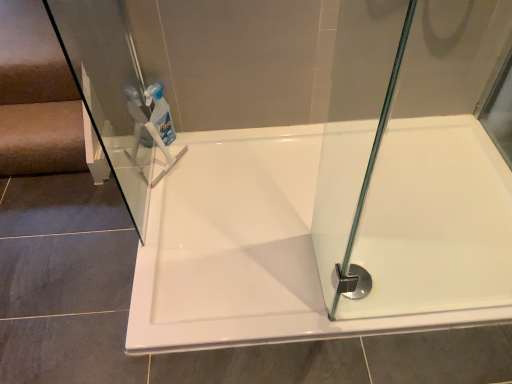
This screenshot has height=384, width=512. Find the location of `white glossy bathtub at center`. white glossy bathtub at center is located at coordinates (247, 251).

I want to click on transparent plastic bottle at upper center, so click(160, 113).

Locate an element on the screen. The height and width of the screenshot is (384, 512). white glossy bathtub at center is located at coordinates (247, 251).

Which point is more distant from viewer, (362, 287) or (173, 133)?

The point (173, 133) is farther.

Identify the location of cleaning product above the polished chrome shower at bottom right (from a real-world perspective). (160, 113).

What's the angular difference between polished chrome shower at bottom right and transparent plastic bottle at upper center's facing directions?

The facing directions of polished chrome shower at bottom right and transparent plastic bottle at upper center are 45.5 degrees apart.

In the image, is polished chrome shower at bottom right positioned in front of or behind white glossy bathtub at center?

Visually, polished chrome shower at bottom right is located behind white glossy bathtub at center.

Is point (367, 271) positioned before point (230, 279)?

No, it is not.

Is polished chrome shower at bottom right at the left side of white glossy bathtub at center?

Correct, you'll find polished chrome shower at bottom right to the left of white glossy bathtub at center.

In the scene shown: Is polished chrome shower at bottom right not close to white glossy bathtub at center?

A: No, there isn't a large distance between polished chrome shower at bottom right and white glossy bathtub at center.

Measure the distance between white glossy bathtub at center and polished chrome shower at bottom right.

They are 42.04 centimeters apart.

Can you tell me how much white glossy bathtub at center and polished chrome shower at bottom right differ in facing direction?

The facing directions of white glossy bathtub at center and polished chrome shower at bottom right are 1.78 degrees apart.

Is white glossy bathtub at center facing towards polished chrome shower at bottom right?

Yes.

Is white glossy bathtub at center not within polished chrome shower at bottom right?

white glossy bathtub at center is positioned outside polished chrome shower at bottom right.

From the image's perspective, between white glossy bathtub at center and transparent plastic bottle at upper center, which one is located above?

transparent plastic bottle at upper center appears higher in the image.

Does white glossy bathtub at center have a lesser width compared to transparent plastic bottle at upper center?

No, white glossy bathtub at center is not thinner than transparent plastic bottle at upper center.

How many degrees apart are the facing directions of white glossy bathtub at center and transparent plastic bottle at upper center?

They differ by 47.2 degrees in their facing directions.

Which object is further away from the camera taking this photo, white glossy bathtub at center or transparent plastic bottle at upper center?

transparent plastic bottle at upper center.

Considering the positions of objects transparent plastic bottle at upper center and polished chrome shower at bottom right in the image provided, who is more to the left, transparent plastic bottle at upper center or polished chrome shower at bottom right?

Positioned to the left is transparent plastic bottle at upper center.

Would you say transparent plastic bottle at upper center is a long distance from polished chrome shower at bottom right?

That's not correct — transparent plastic bottle at upper center is a little close to polished chrome shower at bottom right.

Is point (153, 123) positioned behind point (336, 266)?

Yes, point (153, 123) is farther from viewer.

From the picture: Is transparent plastic bottle at upper center positioned with its back to polished chrome shower at bottom right?

No, transparent plastic bottle at upper center is not facing the opposite direction of polished chrome shower at bottom right.

Is point (166, 136) closer to camera compared to point (189, 181)?

No, (166, 136) is behind (189, 181).

From the image's perspective, is transparent plastic bottle at upper center on top of white glossy bathtub at center?

Yes, from the image's perspective, transparent plastic bottle at upper center is on top of white glossy bathtub at center.

Looking at the image, does transparent plastic bottle at upper center seem bigger or smaller compared to white glossy bathtub at center?

Clearly, transparent plastic bottle at upper center is smaller in size than white glossy bathtub at center.

Identify the location of cleaning product on the left of the polished chrome shower at bottom right. The height and width of the screenshot is (384, 512). (160, 113).

In the image, there is a polished chrome shower at bottom right. Find the location of `bathtub above it (from the image's perspective)`. bathtub above it (from the image's perspective) is located at coordinates (247, 251).

Based on the photo, looking at the image, which one is located further to polished chrome shower at bottom right, white glossy bathtub at center or transparent plastic bottle at upper center?

Among the two, transparent plastic bottle at upper center is located further to polished chrome shower at bottom right.

Looking at the image, which one is located further to transparent plastic bottle at upper center, polished chrome shower at bottom right or white glossy bathtub at center?

polished chrome shower at bottom right.

Considering their positions, is polished chrome shower at bottom right positioned closer to white glossy bathtub at center than transparent plastic bottle at upper center?

polished chrome shower at bottom right lies closer to white glossy bathtub at center than the other object.

Estimate the real-world distances between objects in this image. Which object is closer to polished chrome shower at bottom right, transparent plastic bottle at upper center or white glossy bathtub at center?

Among the two, white glossy bathtub at center is located nearer to polished chrome shower at bottom right.

When comparing their distances from transparent plastic bottle at upper center, does white glossy bathtub at center or polished chrome shower at bottom right seem closer?

white glossy bathtub at center is closer to transparent plastic bottle at upper center.

Looking at the image, which one is located further to white glossy bathtub at center, transparent plastic bottle at upper center or polished chrome shower at bottom right?

transparent plastic bottle at upper center lies further to white glossy bathtub at center than the other object.

The width and height of the screenshot is (512, 384). I want to click on shower between transparent plastic bottle at upper center and white glossy bathtub at center in the horizontal direction, so click(x=354, y=282).